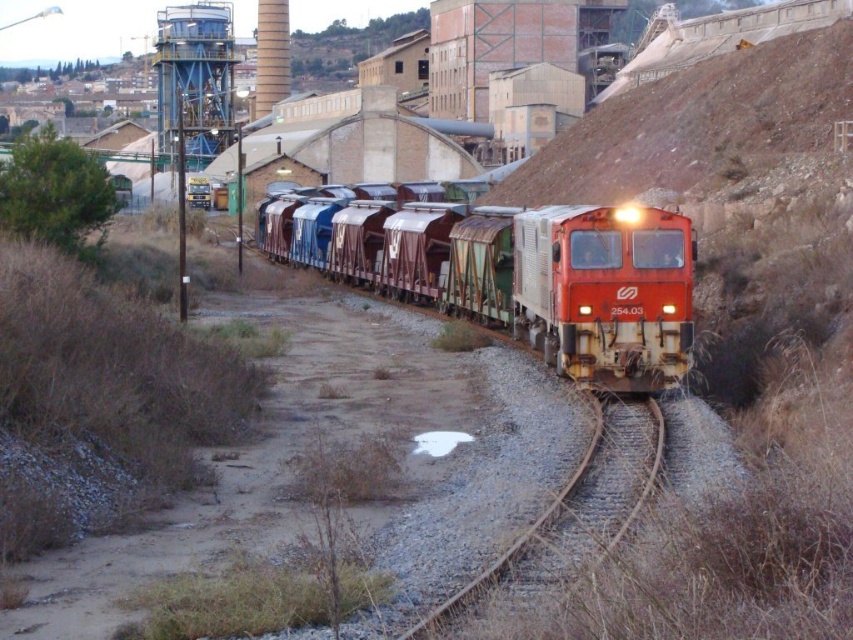
Question: Is rusty metal train at center below rusty metal train track at lower right?

Choices:
 (A) no
 (B) yes

Answer: (A)

Question: Is rusty metal train at center positioned in front of rusty metal train track at lower right?

Choices:
 (A) yes
 (B) no

Answer: (B)

Question: Which point is farther to the camera?

Choices:
 (A) rusty metal train track at lower right
 (B) rusty metal train at center

Answer: (B)

Question: In this image, where is rusty metal train at center located relative to rusty metal train track at lower right?

Choices:
 (A) left
 (B) right

Answer: (A)